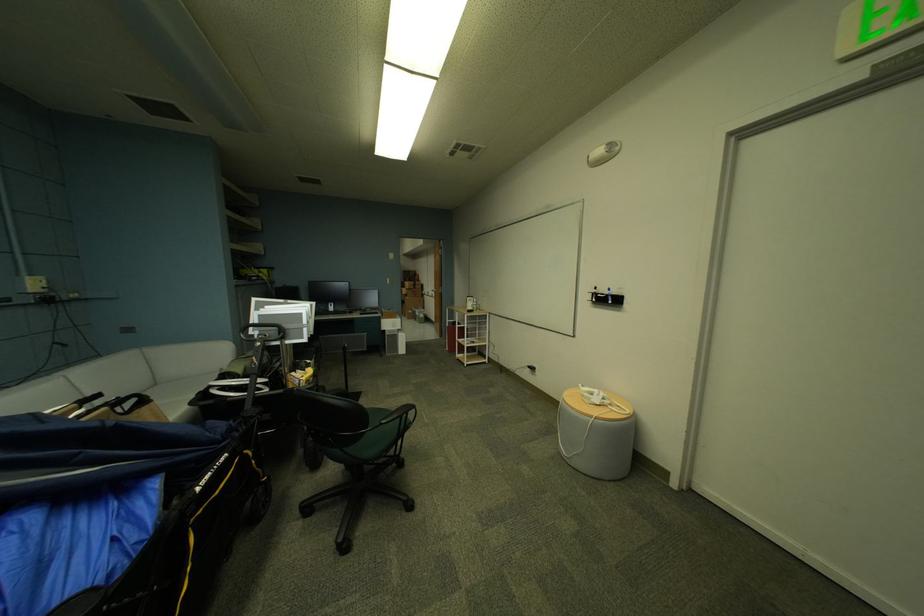
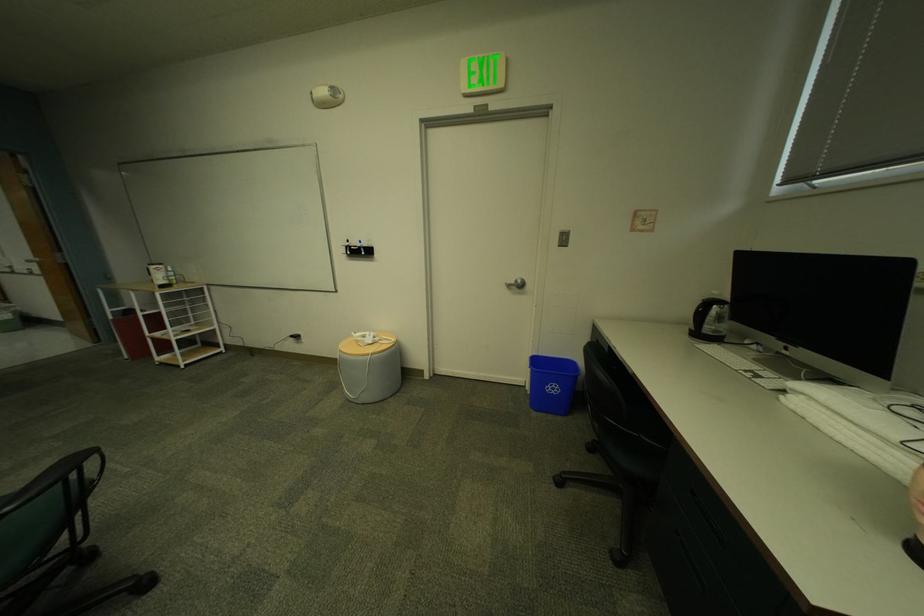
Question: The camera is either moving clockwise (left) or counter-clockwise (right) around the object. The first image is from the beginning of the video and the second image is from the end. Is the camera moving left or right when shooting the video?

Choices:
 (A) Left
 (B) Right

Answer: (A)